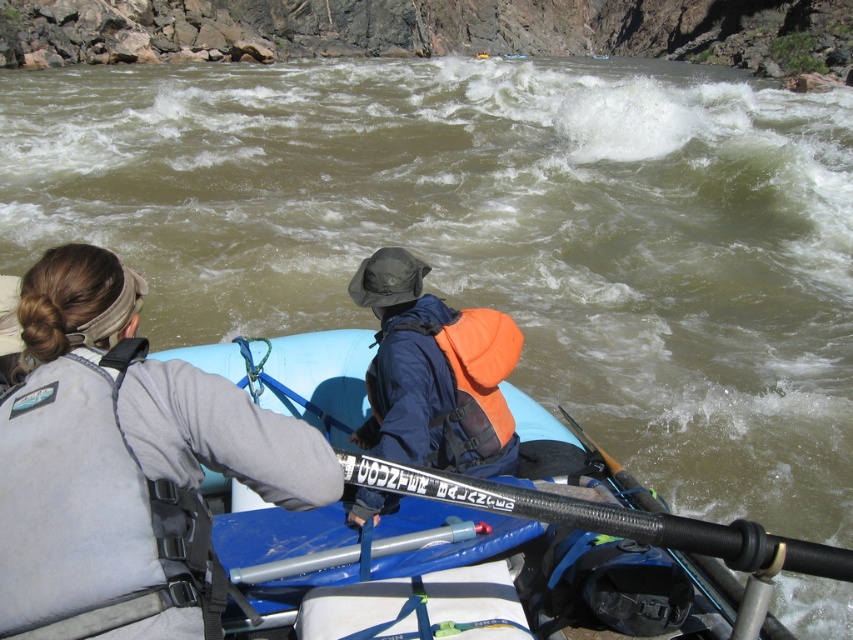
Question: Does gray fabric life vest at left have a greater width compared to blue rubber boat at center?

Choices:
 (A) yes
 (B) no

Answer: (A)

Question: Which object is the farthest from the blue rubber boat at center?

Choices:
 (A) black textured paddle at center
 (B) gray fabric life vest at left
 (C) orange fleece life jacket at center

Answer: (A)

Question: Is blue rubber boat at center positioned behind orange fleece life jacket at center?

Choices:
 (A) no
 (B) yes

Answer: (B)

Question: Which object is positioned closest to the orange fleece life jacket at center?

Choices:
 (A) black textured paddle at center
 (B) blue rubber boat at center
 (C) gray fabric life vest at left

Answer: (B)

Question: Is gray fabric life vest at left behind blue rubber boat at center?

Choices:
 (A) no
 (B) yes

Answer: (A)

Question: Which object is farther from the camera taking this photo?

Choices:
 (A) black textured paddle at center
 (B) blue rubber boat at center
 (C) gray fabric life vest at left

Answer: (B)